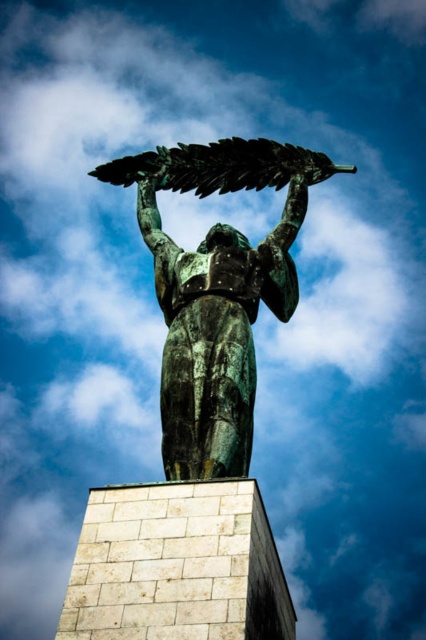
Can you confirm if bronze statue at center is wider than green patina leaf at upper center?

No.

Is point (290, 189) farther from camera compared to point (126, 161)?

No, it is not.

Identify the location of bronze statue at center. The height and width of the screenshot is (640, 426). tap(216, 291).